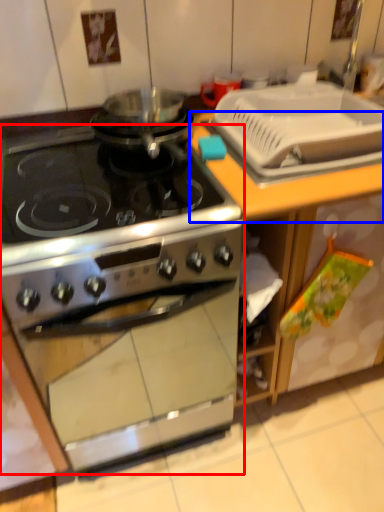
Question: Among these objects, which one is nearest to the camera, kitchen appliance (highlighted by a red box) or counter top (highlighted by a blue box)?

Choices:
 (A) kitchen appliance
 (B) counter top

Answer: (A)